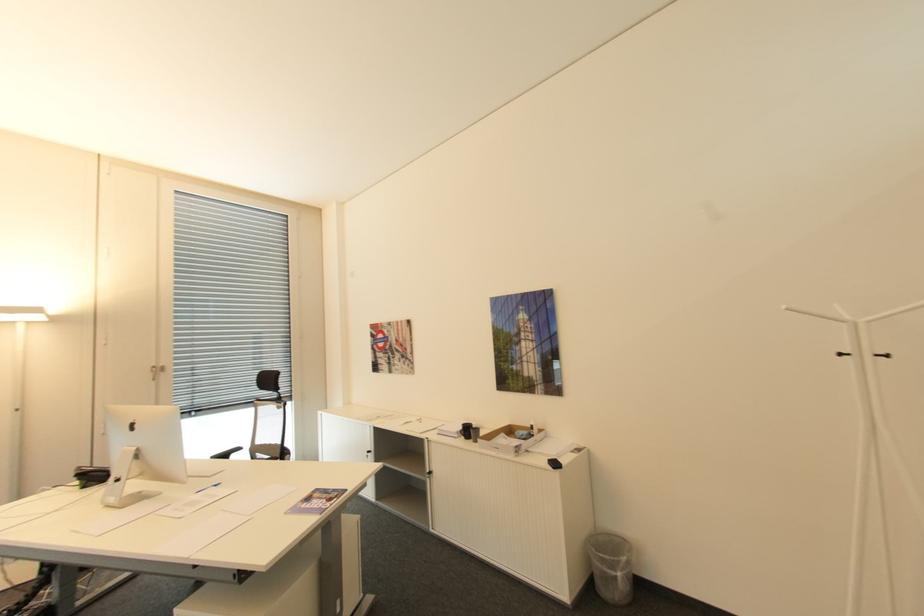
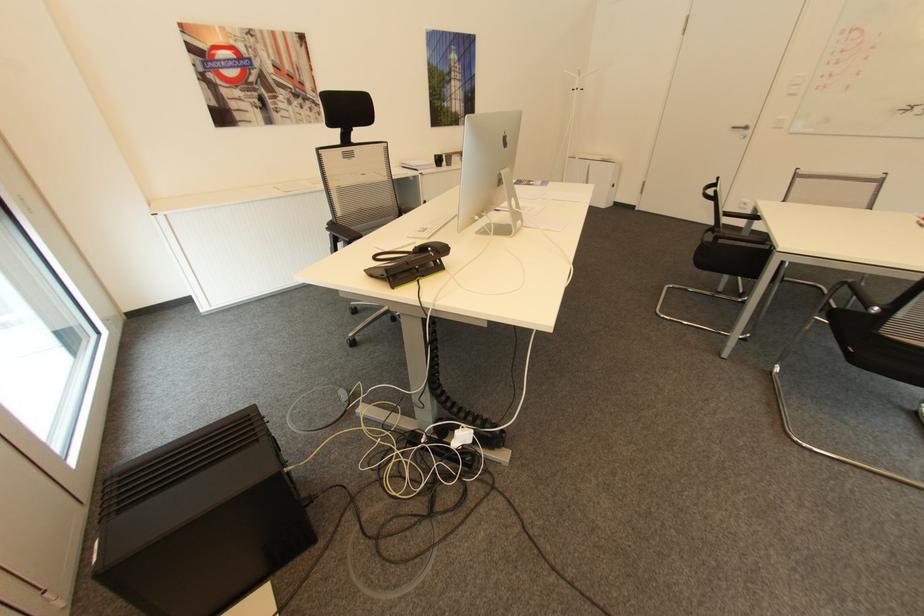
In the second image, find the point that corresponds to pixel 850 322 in the first image.

(582, 76)